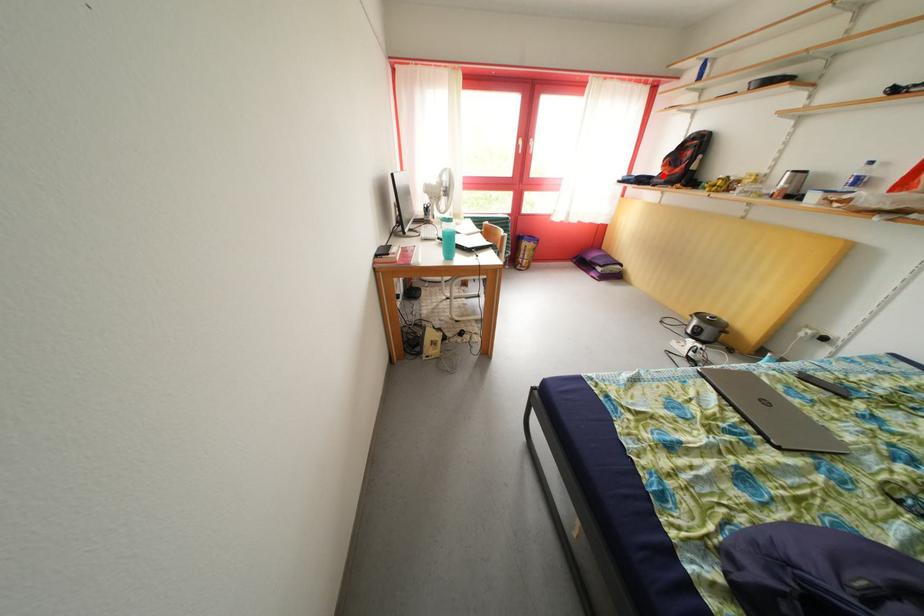
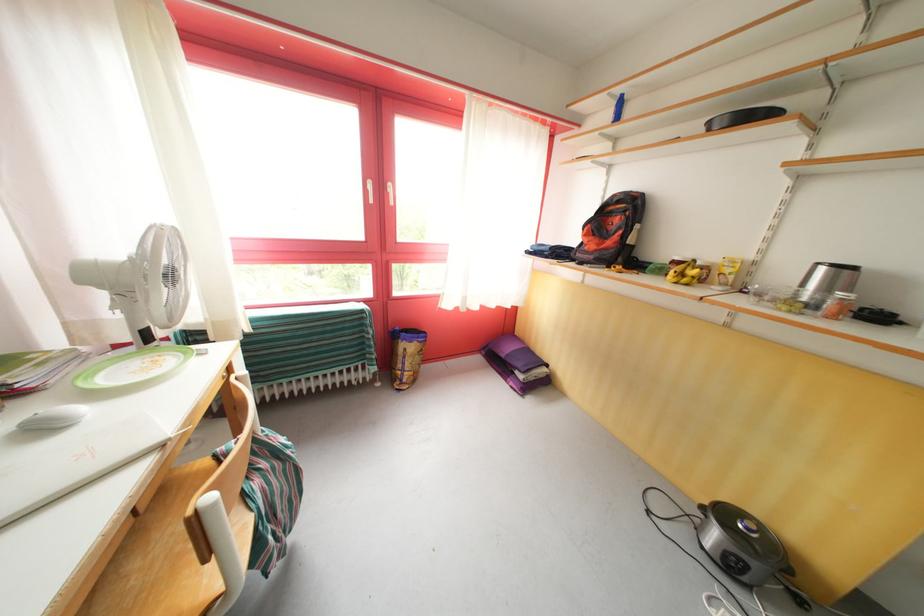
Locate, in the second image, the point that corresponds to the highlighted location in the first image.

(580, 245)